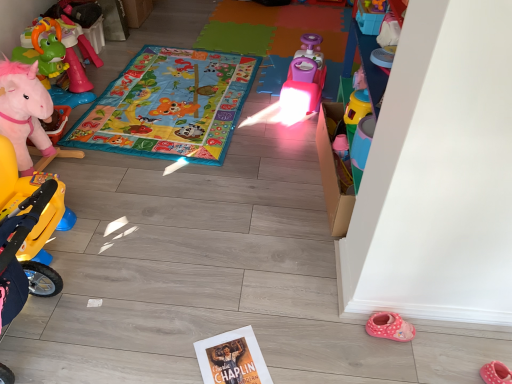
At what (x,y) coordinates should I click in order to perform the action: click on free region under multicolored fabric play mat at center (from a real-world perspective). Please return your answer as a coordinate pair (x, y). This screenshot has height=384, width=512. Looking at the image, I should click on (164, 102).